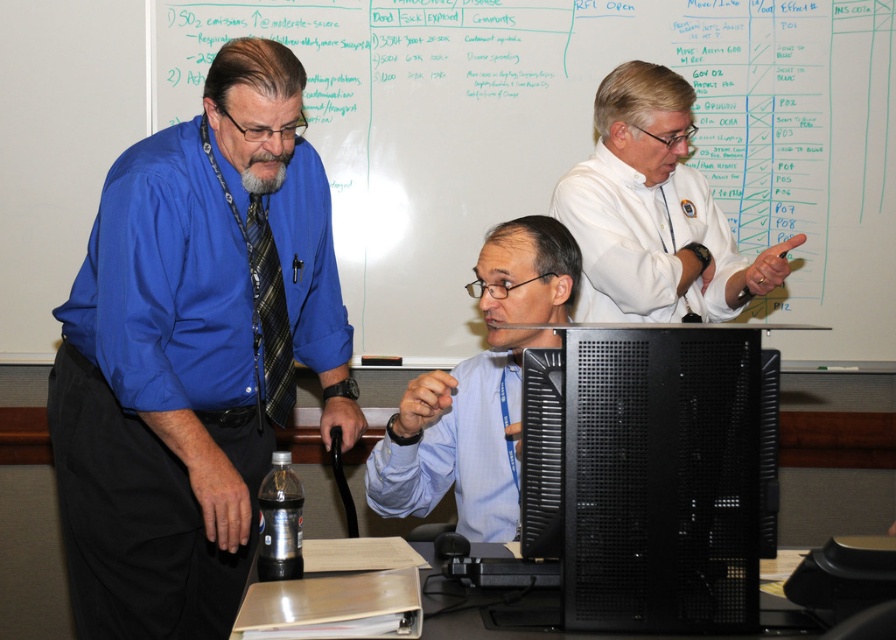
Question: Can you confirm if black matte desktop computer at center is wider than white shirt at upper right?

Choices:
 (A) yes
 (B) no

Answer: (B)

Question: Which object is positioned farthest from the black matte desktop computer at center?

Choices:
 (A) light blue shirt at center
 (B) whiteboard at upper center
 (C) matte blue shirt at left

Answer: (B)

Question: Which point appears closest to the camera in this image?

Choices:
 (A) (271, 177)
 (B) (504, 524)
 (C) (773, 192)
 (D) (253, 198)

Answer: (A)

Question: From the image, what is the correct spatial relationship of whiteboard at upper center in relation to plaid fabric tie at left?

Choices:
 (A) right
 (B) left

Answer: (A)

Question: Which object appears closest to the camera in this image?

Choices:
 (A) light blue shirt at center
 (B) black matte desktop computer at center
 (C) whiteboard at upper center

Answer: (B)

Question: Where is matte blue shirt at left located in relation to light blue shirt at center in the image?

Choices:
 (A) below
 (B) above

Answer: (B)